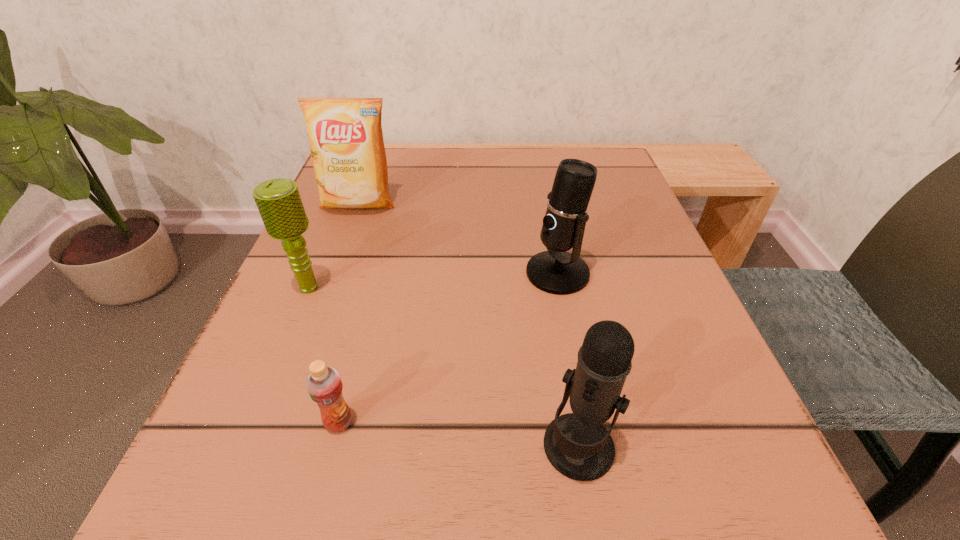
Find the location of a particular element. The width and height of the screenshot is (960, 540). unoccupied position between the orange juice and the leftmost microphone is located at coordinates click(324, 355).

Locate an element on the screen. free space between the leftmost microphone and the nearest microphone is located at coordinates (444, 368).

Where is `free space between the farthest object and the nearest microphone`? The height and width of the screenshot is (540, 960). free space between the farthest object and the nearest microphone is located at coordinates (468, 326).

At what (x,y) coordinates should I click in order to perform the action: click on vacant point located between the shortest object and the nearest microphone. Please return your answer as a coordinate pair (x, y). This screenshot has width=960, height=540. Looking at the image, I should click on (459, 435).

Find the location of `empty space between the nearest microphone and the shortest object`. empty space between the nearest microphone and the shortest object is located at coordinates (459, 435).

The image size is (960, 540). Find the location of `object that ranks as the closest to the orange juice`. object that ranks as the closest to the orange juice is located at coordinates (279, 202).

This screenshot has height=540, width=960. What are the coordinates of `object that is the third closest to the orange juice` in the screenshot? It's located at (555, 271).

I want to click on the second closest microphone relative to the leftmost microphone, so click(577, 445).

Locate which microphone ranks third in proximity to the farthest object. Please provide its 2D coordinates. Your answer should be formatted as a tuple, i.e. [(x, y)], where the tuple contains the x and y coordinates of a point satisfying the conditions above.

[(577, 445)]

At what (x,y) coordinates should I click in order to perform the action: click on free location that satisfies the following two spatial constraints: 1. on the front-facing side of the crisp (potato chip); 2. on the left side of the shortest object. Please return your answer as a coordinate pair (x, y). Looking at the image, I should click on (277, 422).